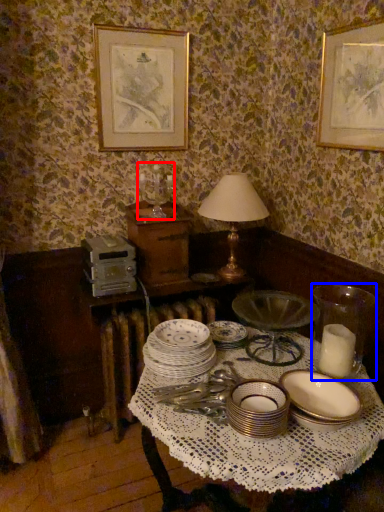
Question: Which object is closer to the camera taking this photo, candle holder (highlighted by a red box) or tableware (highlighted by a blue box)?

Choices:
 (A) candle holder
 (B) tableware

Answer: (B)